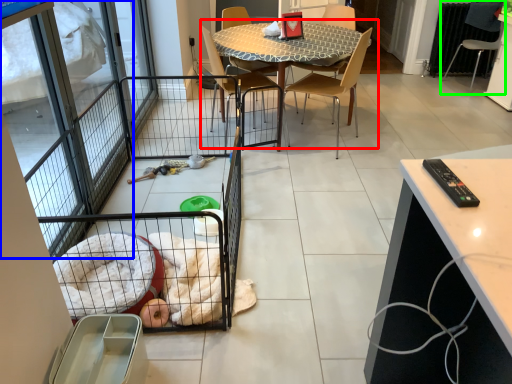
Question: Estimate the real-world distances between objects in this image. Which object is closer to kitchen & dining room table (highlighted by a red box), screen door (highlighted by a blue box) or chair (highlighted by a green box)?

Choices:
 (A) screen door
 (B) chair

Answer: (A)